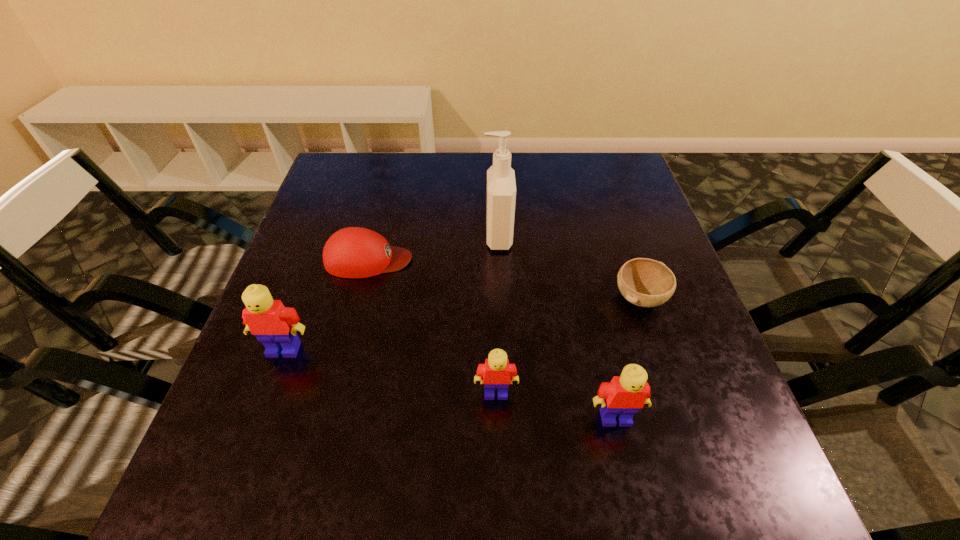
You are a GUI agent. You are given a task and a screenshot of the screen. Output one action in this format:
    pyautogui.click(x=<x>, y=<y>)
    Task: Click on the leftmost Lego
    The image size is (960, 540).
    Given the screenshot: What is the action you would take?
    pyautogui.click(x=275, y=325)

Find the location of a particular element. The height and width of the screenshot is (540, 960). the fourth farthest object is located at coordinates (275, 325).

Where is `the second nearest object`? The image size is (960, 540). the second nearest object is located at coordinates (496, 373).

Locate an element on the screen. The width and height of the screenshot is (960, 540). the third shortest object is located at coordinates (496, 373).

Locate an element on the screen. Image resolution: width=960 pixels, height=540 pixels. the rightmost Lego is located at coordinates (626, 394).

Where is `the nearest Lego`? This screenshot has width=960, height=540. the nearest Lego is located at coordinates (626, 394).

This screenshot has width=960, height=540. What are the coordinates of `the tallest object` in the screenshot? It's located at (501, 187).

I want to click on the fifth tallest object, so click(x=354, y=252).

Find the location of a particular element. The width and height of the screenshot is (960, 540). bowl is located at coordinates (644, 282).

Find the location of `the rightmost object`. the rightmost object is located at coordinates (644, 282).